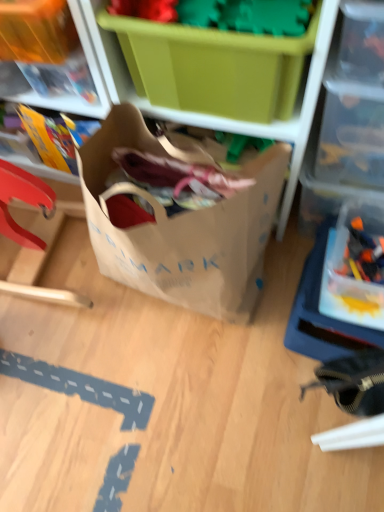
Find the location of a particular element. The image size is (384, 512). free space that is to the left of brown paper bag at center is located at coordinates (64, 353).